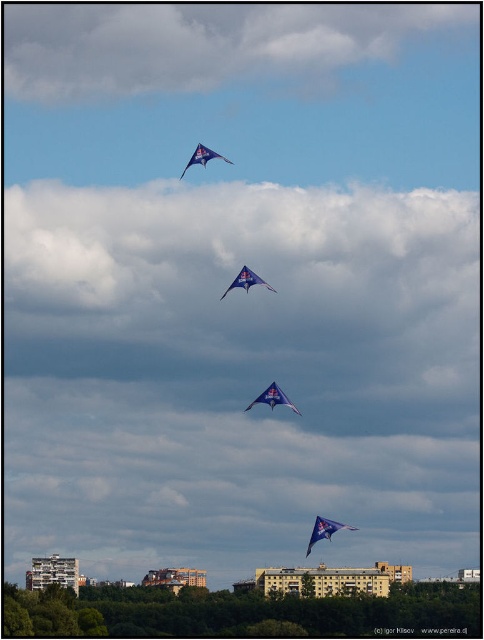
You are a photographer trying to capture a photo of the blue fabric kite at upper center. There is a white fluffy cloud at upper center in the way. Can you estimate if the cloud will block the entire kite in the photo?

The white fluffy cloud at upper center is wider than the blue fabric kite at upper center, so it might block the entire kite in the photo.

You are a pilot flying an airplane that is 30 meters long. You want to fly your plane between the white fluffy cloud at upper center and the nearest building. What is the minimum distance you need to maintain between your plane and the cloud to ensure safety?

The white fluffy cloud at upper center and viewer are 657.71 meters apart from each other. Since the nearest building is not mentioned in the scene description, we cannot determine its distance. Therefore, the minimum safe distance should be based on the cloud distance alone. However, without knowing the plane size or safety regulations, we can only state the existing distance between the viewer and the cloud is 657.71 meters.